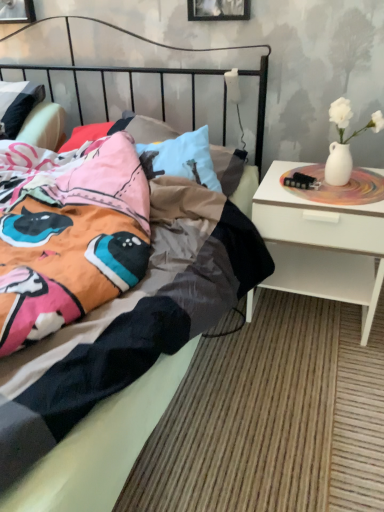
The height and width of the screenshot is (512, 384). Identify the location of vacant area in front of white glossy nightstand at right. pos(310,374).